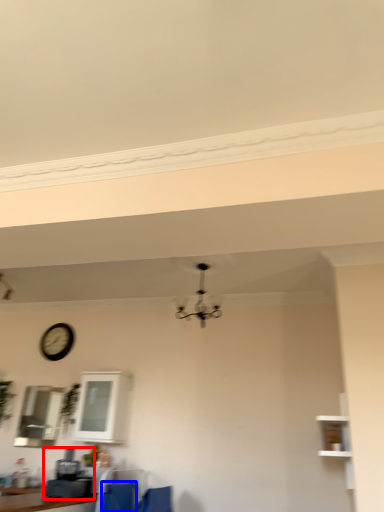
Question: Which point is further to the camera, coffee machine (highlighted by a red box) or feeding chair (highlighted by a blue box)?

Choices:
 (A) coffee machine
 (B) feeding chair

Answer: (B)